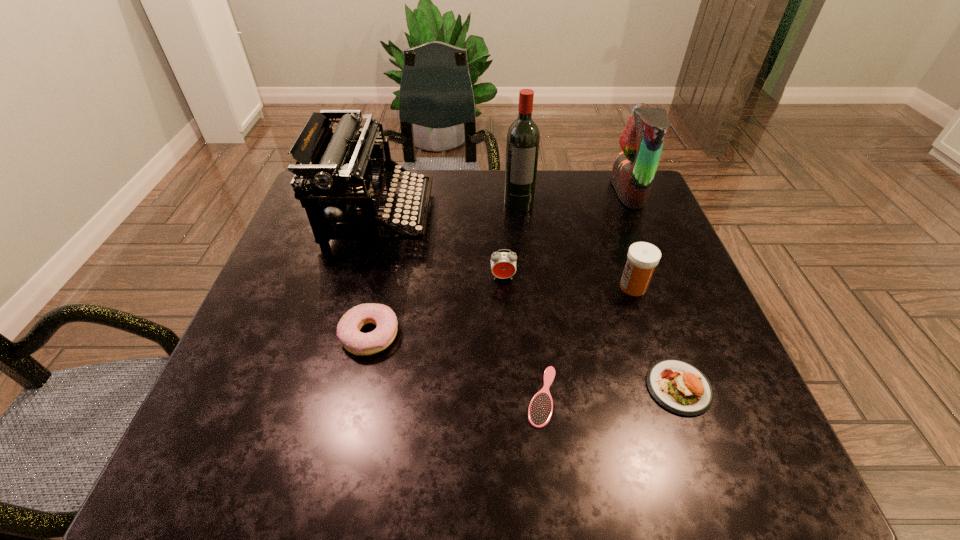
The width and height of the screenshot is (960, 540). What are the coordinates of `vacant space that satisfies the following two spatial constraints: 1. on the label of the tallest object; 2. on the typing side of the typewriter` in the screenshot? It's located at (520, 216).